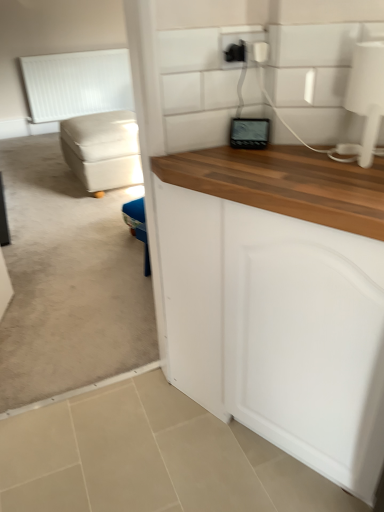
I want to click on white matte radiator at upper left, so click(x=77, y=84).

Image resolution: width=384 pixels, height=512 pixels. I want to click on beige fabric ottoman at left, so click(103, 150).

Measure the distance between beige fabric ottoman at left and camera.

beige fabric ottoman at left is 3.08 meters away from camera.

Where is `white matte radiator at upper left`? white matte radiator at upper left is located at coordinates (77, 84).

Identify the location of radiator above the beige fabric ottoman at left (from a real-world perspective). (77, 84).

From the image's perspective, is white matte radiator at upper left above or below beige fabric ottoman at left?

Clearly, from the image's perspective, white matte radiator at upper left is above beige fabric ottoman at left.

Consider the image. How different are the orientations of white matte radiator at upper left and beige fabric ottoman at left in degrees?

87.8 degrees.

Does white matte radiator at upper left touch beige fabric ottoman at left?

No, white matte radiator at upper left is not next to beige fabric ottoman at left.

From a real-world perspective, is beige fabric ottoman at left physically above black plastic outlet at upper center?

Incorrect, from a real-world perspective, beige fabric ottoman at left is lower than black plastic outlet at upper center.

Is beige fabric ottoman at left taller than black plastic outlet at upper center?

Indeed, beige fabric ottoman at left has a greater height compared to black plastic outlet at upper center.

From the image's perspective, which object appears higher, beige fabric ottoman at left or black plastic outlet at upper center?

beige fabric ottoman at left, from the image's perspective.

Can you confirm if beige fabric ottoman at left is smaller than black plastic outlet at upper center?

Incorrect, beige fabric ottoman at left is not smaller in size than black plastic outlet at upper center.

Is the surface of black plastic outlet at upper center in direct contact with white matte radiator at upper left?

black plastic outlet at upper center and white matte radiator at upper left are not in contact.

Considering the relative positions of black plastic outlet at upper center and white matte radiator at upper left in the image provided, is black plastic outlet at upper center to the left of white matte radiator at upper left from the viewer's perspective?

Incorrect, black plastic outlet at upper center is not on the left side of white matte radiator at upper left.

In the scene shown: Would you say black plastic outlet at upper center is inside or outside white matte radiator at upper left?

black plastic outlet at upper center cannot be found inside white matte radiator at upper left.

Can you confirm if white matte radiator at upper left is wider than black plastic outlet at upper center?

Indeed, white matte radiator at upper left has a greater width compared to black plastic outlet at upper center.

What are the coordinates of `radiator that appears below the black plastic outlet at upper center (from a real-world perspective)` in the screenshot? It's located at (77, 84).

How far apart are white matte radiator at upper left and black plastic outlet at upper center?

white matte radiator at upper left and black plastic outlet at upper center are 5.18 meters apart from each other.

Could you tell me if white matte radiator at upper left is facing black plastic outlet at upper center?

Yes, white matte radiator at upper left is turned towards black plastic outlet at upper center.

Is beige fabric ottoman at left turned away from white matte radiator at upper left?

No.

Is beige fabric ottoman at left beside white matte radiator at upper left?

No, beige fabric ottoman at left is not with white matte radiator at upper left.

Is beige fabric ottoman at left bigger than white matte radiator at upper left?

Correct, beige fabric ottoman at left is larger in size than white matte radiator at upper left.

Is point (239, 34) positioned after point (133, 156)?

No, it is in front of (133, 156).

From a real-world perspective, which is physically above, black plastic outlet at upper center or beige fabric ottoman at left?

From a 3D spatial view, black plastic outlet at upper center is above.

Is black plastic outlet at upper center not inside beige fabric ottoman at left?

Yes, black plastic outlet at upper center is not within beige fabric ottoman at left.

Identify the location of electric outlet in front of the beige fabric ottoman at left. (239, 47).

You are a GUI agent. You are given a task and a screenshot of the screen. Output one action in this format:
    pyautogui.click(x=<x>, y=<y>)
    Task: Click on the studio couch below the white matte radiator at upper left (from a real-world perspective)
    This screenshot has width=384, height=512.
    Given the screenshot: What is the action you would take?
    pyautogui.click(x=103, y=150)

This screenshot has height=512, width=384. Identify the location of electric outlet located in front of the beige fabric ottoman at left. (239, 47).

From the image, which object appears to be nearer to white matte radiator at upper left, black plastic outlet at upper center or beige fabric ottoman at left?

Among the two, beige fabric ottoman at left is located nearer to white matte radiator at upper left.

When comparing their distances from white matte radiator at upper left, does beige fabric ottoman at left or black plastic outlet at upper center seem closer?

Based on the image, beige fabric ottoman at left appears to be nearer to white matte radiator at upper left.

Based on their spatial positions, is white matte radiator at upper left or beige fabric ottoman at left closer to black plastic outlet at upper center?

The object closer to black plastic outlet at upper center is beige fabric ottoman at left.

Estimate the real-world distances between objects in this image. Which object is closer to beige fabric ottoman at left, white matte radiator at upper left or black plastic outlet at upper center?

black plastic outlet at upper center.

Considering their positions, is beige fabric ottoman at left positioned further to black plastic outlet at upper center than white matte radiator at upper left?

Based on the image, white matte radiator at upper left appears to be further to black plastic outlet at upper center.

When comparing their distances from beige fabric ottoman at left, does black plastic outlet at upper center or white matte radiator at upper left seem further?

white matte radiator at upper left lies further to beige fabric ottoman at left than the other object.

Locate an element on the screen. The height and width of the screenshot is (512, 384). studio couch between black plastic outlet at upper center and white matte radiator at upper left in the front-back direction is located at coordinates (103, 150).